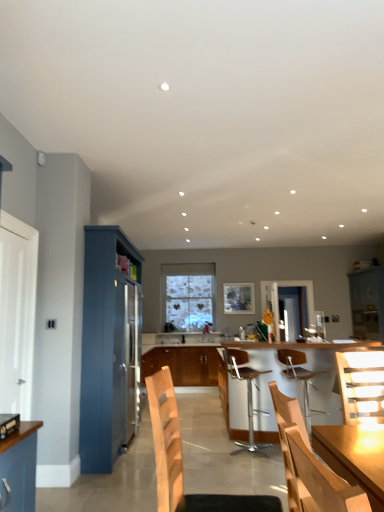
Question: Is point (18, 428) closer or farther from the camera than point (299, 461)?

Choices:
 (A) farther
 (B) closer

Answer: (A)

Question: Is brushed metal toaster at left in front of or behind wooden chair at center, the fifth chair from the back, in the image?

Choices:
 (A) front
 (B) behind

Answer: (B)

Question: Considering the real-world distances, which object is farthest from the metallic silver bar stool at center, acting as the 2th chair starting from the back?

Choices:
 (A) white glossy door at left, the 2th glass door positioned from the back
 (B) brushed metal toaster at left
 (C) wooden cabinet at center, marked as the third cabinetry in a front-to-back arrangement
 (D) transparent glass door at center, which appears as the 2th glass door when viewed from the front
 (E) wooden chair at center, placed as the 1th chair when sorted from front to back

Answer: (D)

Question: Which is farther from the wooden chair at center, placed as the 1th chair when sorted from front to back?

Choices:
 (A) matte blue cabinet at right, the 2th cabinetry in the front-to-back sequence
 (B) blue painted cabinet at left, placed as the first cabinetry when sorted from front to back
 (C) wooden chair at right, acting as the 3th chair starting from the front
 (D) wooden cabinet at center, marked as the third cabinetry in a front-to-back arrangement
 (E) wooden chair at center, which is the 4th chair from back to front

Answer: (A)